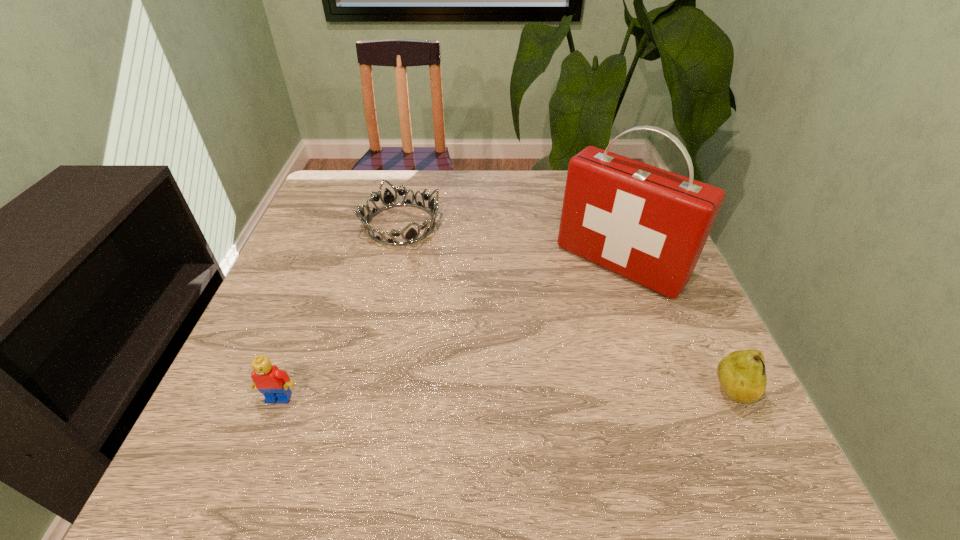
Where is `vacant position located 0.370m on the front-facing side of the third object from right to left`? The height and width of the screenshot is (540, 960). vacant position located 0.370m on the front-facing side of the third object from right to left is located at coordinates (481, 356).

The width and height of the screenshot is (960, 540). I want to click on vacant space situated on the front-facing side of the third object from right to left, so click(x=476, y=348).

At what (x,y) coordinates should I click in order to perform the action: click on object at the far edge. Please return your answer as a coordinate pair (x, y). Looking at the image, I should click on (411, 236).

Identify the location of Lego present at the near edge. This screenshot has height=540, width=960. (273, 383).

This screenshot has width=960, height=540. In order to click on pear that is positioned at the near edge in this screenshot , I will do 742,374.

Where is `Lego situated at the left edge`? Lego situated at the left edge is located at coordinates (273, 383).

This screenshot has height=540, width=960. I want to click on tiara that is at the left edge, so click(x=411, y=236).

At what (x,y) coordinates should I click in order to perform the action: click on pear situated at the right edge. Please return your answer as a coordinate pair (x, y). Looking at the image, I should click on (742, 374).

Find the location of a particular element. The image size is (960, 540). the first-aid kit that is at the right edge is located at coordinates (649, 225).

Find the location of a particular element. The width and height of the screenshot is (960, 540). object that is at the far left corner is located at coordinates (411, 236).